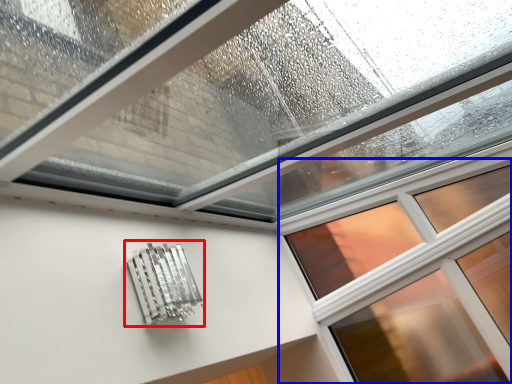
Question: Among these objects, which one is nearest to the camera, metal (highlighted by a red box) or window (highlighted by a blue box)?

Choices:
 (A) metal
 (B) window

Answer: (A)